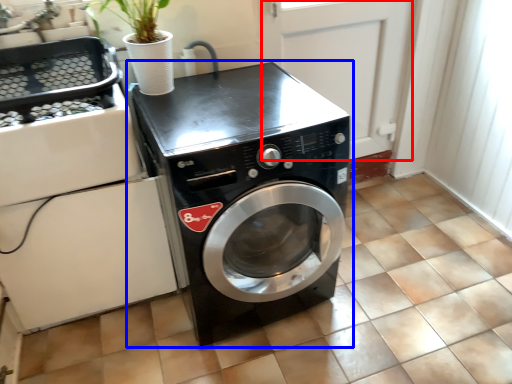
Question: Among these objects, which one is nearest to the camera, screen door (highlighted by a red box) or washing machine (highlighted by a blue box)?

Choices:
 (A) screen door
 (B) washing machine

Answer: (B)